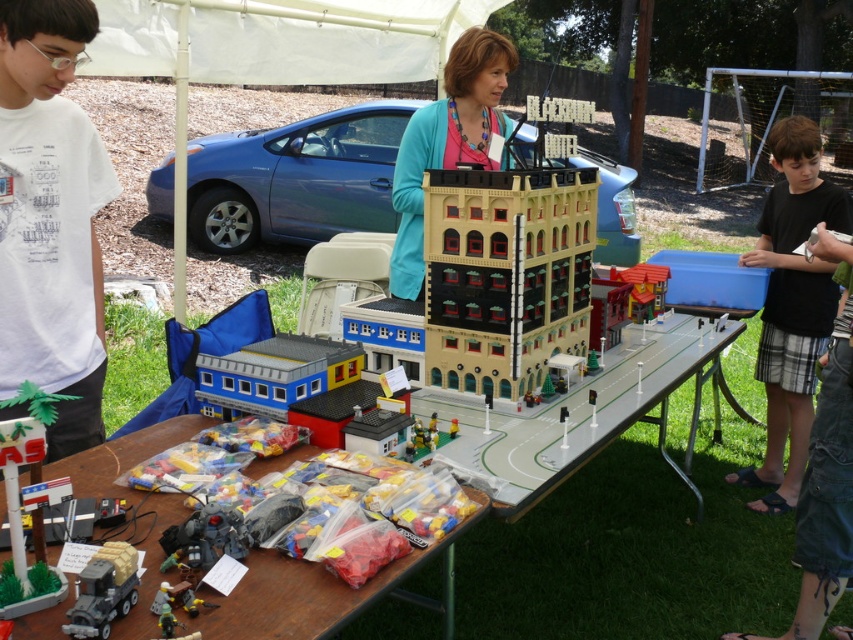
Question: Considering the real-world distances, which object is farthest from the white t-shirt at left?

Choices:
 (A) brick-red plastic building at center
 (B) blue plastic building at lower left
 (C) wooden table at center
 (D) matte teal sweater at center

Answer: (A)

Question: Which of these objects is positioned closest to the matte teal sweater at center?

Choices:
 (A) translucent plastic bags at lower center
 (B) white t-shirt at left
 (C) shiny metallic robot at lower left
 (D) wooden table at center

Answer: (B)

Question: Is wooden table at center smaller than black plaid shorts at lower right?

Choices:
 (A) no
 (B) yes

Answer: (A)

Question: Does black plaid shorts at lower right have a greater width compared to blue plastic building at lower left?

Choices:
 (A) yes
 (B) no

Answer: (B)

Question: Where is wooden table at center located in relation to shiny metallic robot at lower left in the image?

Choices:
 (A) below
 (B) above

Answer: (A)

Question: Which point appears closest to the camera in this image?

Choices:
 (A) (215, 616)
 (B) (532, 362)

Answer: (A)